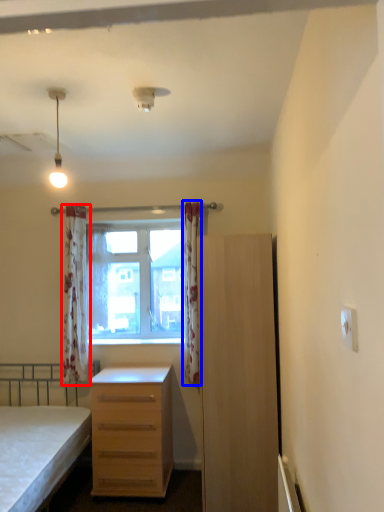
Question: Which point is closer to the camera, curtain (highlighted by a red box) or curtain (highlighted by a blue box)?

Choices:
 (A) curtain
 (B) curtain

Answer: (B)